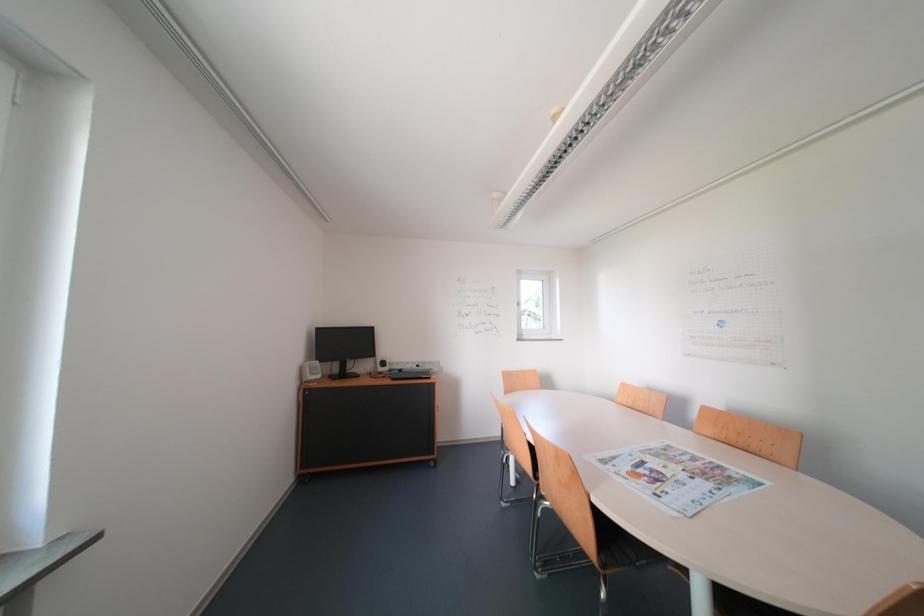
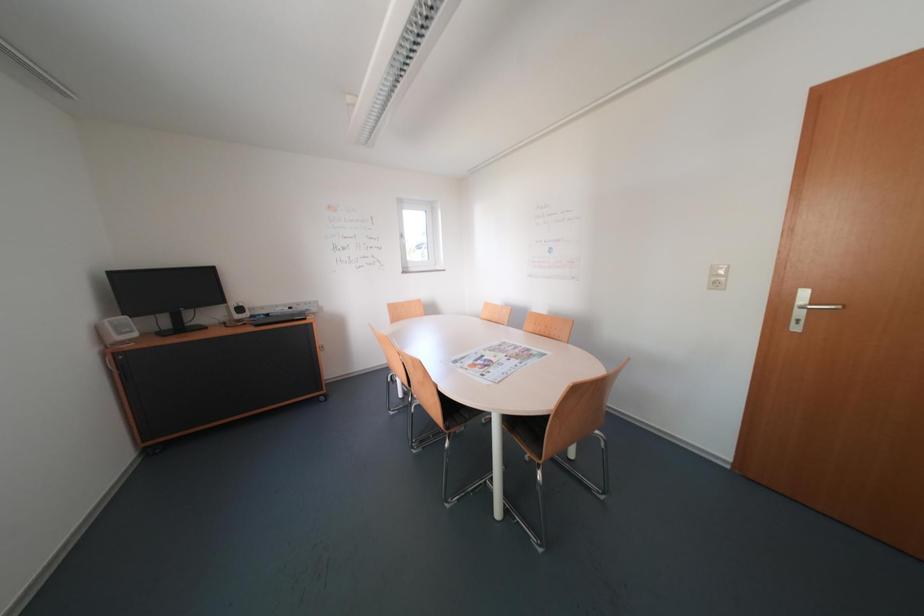
The first image is from the beginning of the video and the second image is from the end. How did the camera likely rotate when shooting the video?

The camera rotated toward right-down.